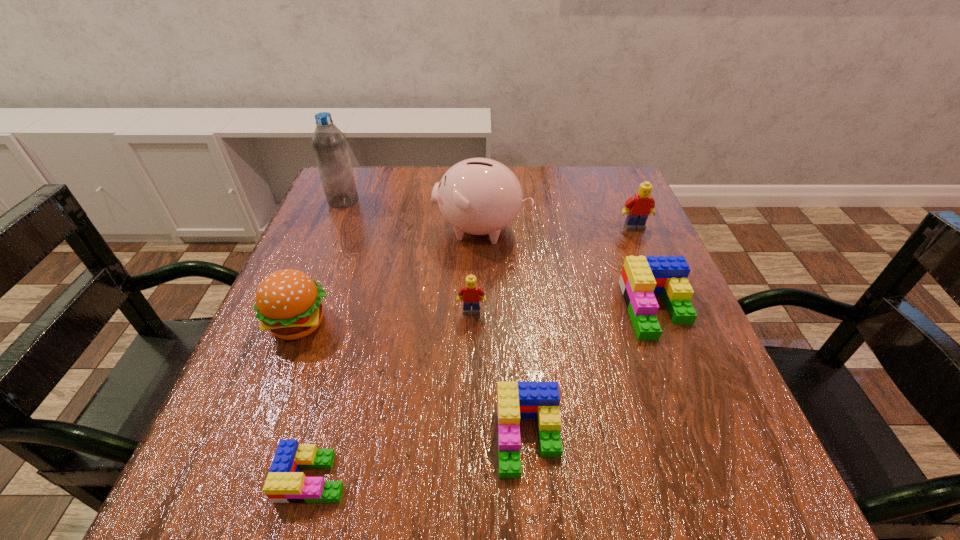
Locate which green Lego is the third closest to the second Lego from left to right. Please provide its 2D coordinates. Your answer should be formatted as a tuple, i.e. [(x, y)], where the tuple contains the x and y coordinates of a point satisfying the conditions above.

[(285, 484)]

In order to click on free space that satisfies the following two spatial constraints: 1. on the front side of the blue water bottle; 2. on the right side of the third Lego from right to left in this screenshot , I will do `click(247, 437)`.